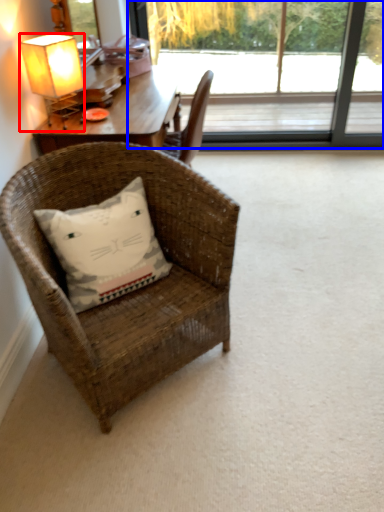
Question: Among these objects, which one is nearest to the camera, lamp (highlighted by a red box) or window (highlighted by a blue box)?

Choices:
 (A) lamp
 (B) window

Answer: (A)